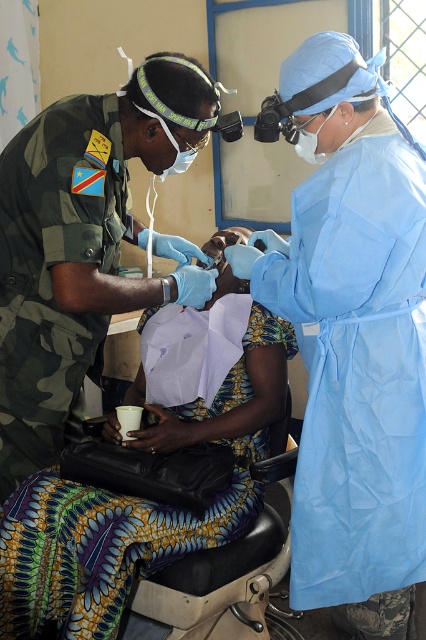
Does camouflage fabric uniform at left come in front of black leather chair at lower center?

Yes, camouflage fabric uniform at left is in front of black leather chair at lower center.

Between camouflage fabric uniform at left and black leather chair at lower center, which one appears on the left side from the viewer's perspective?

camouflage fabric uniform at left

Between point (22, 381) and point (222, 598), which one is positioned in front?

Positioned in front is point (22, 381).

Identify the location of camouflage fabric uniform at left. (83, 244).

Is blue smooth gown at center bigger than printed fabric skirt at center?

No.

At what (x,y) coordinates should I click in order to perform the action: click on blue smooth gown at center. Please return your answer as a coordinate pair (x, y). Looking at the image, I should click on (353, 337).

Who is more distant from viewer, (344, 564) or (103, 328)?

The point (103, 328) is more distant.

In the scene shown: Is blue smooth gown at center bigger than camouflage fabric uniform at left?

Incorrect, blue smooth gown at center is not larger than camouflage fabric uniform at left.

Locate an element on the screen. This screenshot has width=426, height=640. blue smooth gown at center is located at coordinates (353, 337).